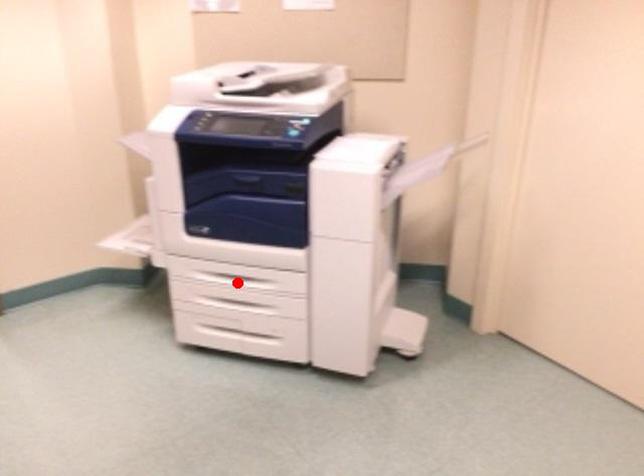
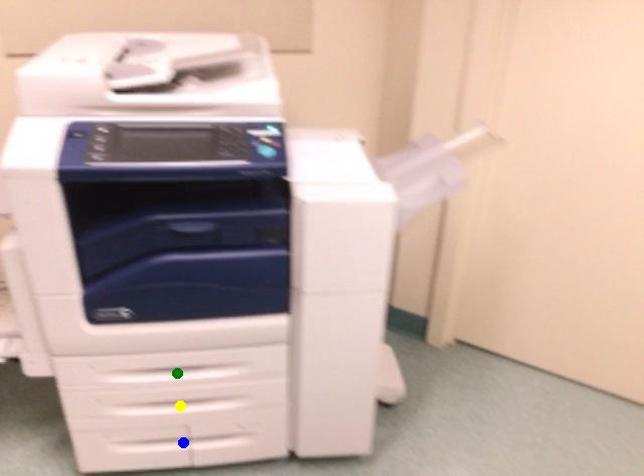
Question: I am providing you with two images of the same scene from different viewpoints. A red point is marked on the first image. You are given multiple points on the second image. Which point in image 2 is actually the same real-world point as the red point in image 1?

Choices:
 (A) blue point
 (B) green point
 (C) yellow point

Answer: (B)